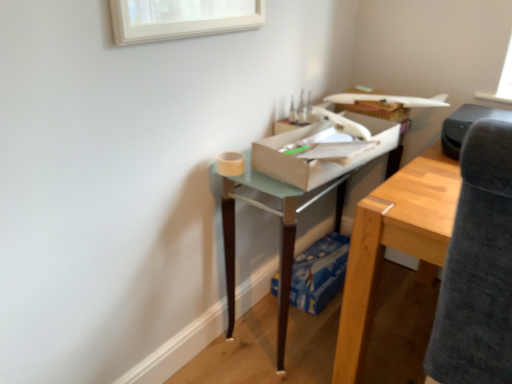
Question: Is white cardboard box at center, which is the 2th cardboard box from back to front, positioned before translucent glass table at center?

Choices:
 (A) no
 (B) yes

Answer: (B)

Question: Can you confirm if white cardboard box at center, which is the 2th cardboard box from back to front, is wider than translucent glass table at center?

Choices:
 (A) yes
 (B) no

Answer: (B)

Question: From the image's perspective, does white cardboard box at center, the 2th cardboard box ordered from the bottom, appear lower than translucent glass table at center?

Choices:
 (A) no
 (B) yes

Answer: (A)

Question: Does white cardboard box at center, acting as the 1th cardboard box starting from the front, have a larger size compared to translucent glass table at center?

Choices:
 (A) no
 (B) yes

Answer: (A)

Question: Does white cardboard box at center, the 2th cardboard box ordered from the bottom, have a greater height compared to translucent glass table at center?

Choices:
 (A) yes
 (B) no

Answer: (B)

Question: Does point (395, 129) appear closer or farther from the camera than point (329, 296)?

Choices:
 (A) closer
 (B) farther

Answer: (A)

Question: From the image's perspective, is white cardboard box at center, acting as the 1th cardboard box starting from the front, above or below blue cardboard box at lower center, the first cardboard box when ordered from bottom to top?

Choices:
 (A) below
 (B) above

Answer: (B)

Question: From a real-world perspective, is white cardboard box at center, which appears as the first cardboard box when viewed from the top, physically located above or below blue cardboard box at lower center, which ranks as the 2th cardboard box in front-to-back order?

Choices:
 (A) below
 (B) above

Answer: (B)

Question: Would you say white cardboard box at center, which appears as the first cardboard box when viewed from the top, is to the left or to the right of blue cardboard box at lower center, the first cardboard box when ordered from bottom to top, in the picture?

Choices:
 (A) right
 (B) left

Answer: (B)

Question: Is blue cardboard box at lower center, which is the second cardboard box in top-to-bottom order, taller or shorter than black plastic printer at upper right?

Choices:
 (A) short
 (B) tall

Answer: (A)

Question: Is blue cardboard box at lower center, the first cardboard box when ordered from bottom to top, spatially inside black plastic printer at upper right, or outside of it?

Choices:
 (A) outside
 (B) inside

Answer: (A)

Question: Considering their positions, is blue cardboard box at lower center, the first cardboard box when ordered from bottom to top, located in front of or behind black plastic printer at upper right?

Choices:
 (A) front
 (B) behind

Answer: (B)

Question: Based on their positions, is blue cardboard box at lower center, the first cardboard box when ordered from bottom to top, located to the left or right of black plastic printer at upper right?

Choices:
 (A) right
 (B) left

Answer: (B)

Question: Looking at the image, does dark gray fabric swivel chair at right seem bigger or smaller compared to translucent glass table at center?

Choices:
 (A) small
 (B) big

Answer: (A)

Question: Is dark gray fabric swivel chair at right inside or outside of translucent glass table at center?

Choices:
 (A) outside
 (B) inside

Answer: (A)